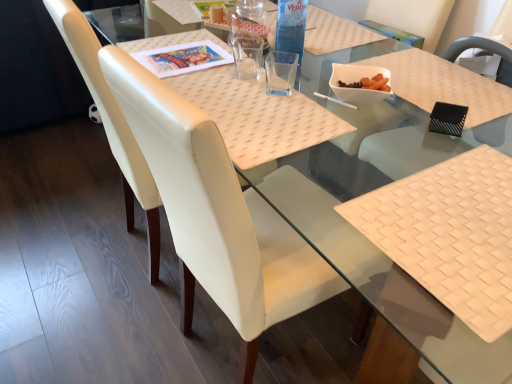
Locate an element on the screen. This screenshot has width=512, height=384. vacant area situated below white woven placemat at lower right (from a real-world perspective) is located at coordinates (455, 214).